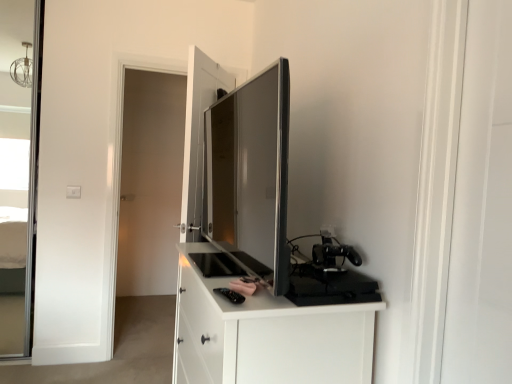
What do you see at coordinates (251, 172) in the screenshot? I see `matte black tv at center, which is the first appliance from left to right` at bounding box center [251, 172].

Image resolution: width=512 pixels, height=384 pixels. Describe the element at coordinates (482, 207) in the screenshot. I see `white glossy screen door at right, which is counted as the first screen door, starting from the right` at that location.

Measure the distance between white glossy screen door at right, the 2th screen door in the back-to-front sequence, and camera.

white glossy screen door at right, the 2th screen door in the back-to-front sequence, is 37.73 inches away from camera.

Describe the element at coordinates (150, 182) in the screenshot. I see `transparent glass door at left, which is the 2th screen door in right-to-left order` at that location.

Describe the element at coordinates (265, 334) in the screenshot. Image resolution: width=512 pixels, height=384 pixels. I see `white matte cabinet at center` at that location.

This screenshot has height=384, width=512. Describe the element at coordinates (333, 256) in the screenshot. I see `black matte gaming console at right, the 1th appliance viewed from the right` at that location.

How much space does black matte gaming console at right, arranged as the 1th appliance when ordered from the bottom, occupy horizontally?

It is 7.28 inches.

Find the location of a particular element. The width and height of the screenshot is (512, 384). matte black tv at center, which is the 2th appliance from right to left is located at coordinates [x=251, y=172].

Does white matte cabinet at center contain black matte gaming console at right, acting as the second appliance starting from the left?

No, black matte gaming console at right, acting as the second appliance starting from the left, is not surrounded by white matte cabinet at center.

Who is smaller, white matte cabinet at center or black matte gaming console at right, acting as the second appliance starting from the left?

black matte gaming console at right, acting as the second appliance starting from the left, is smaller.

Is white matte cabinet at center positioned with its back to black matte gaming console at right, the second appliance positioned from the top?

No, white matte cabinet at center's orientation is not away from black matte gaming console at right, the second appliance positioned from the top.

Considering the relative sizes of matte black tv at center, which is counted as the 1th appliance, starting from the top, and white glossy screen door at right, placed as the first screen door when sorted from front to back, in the image provided, is matte black tv at center, which is counted as the 1th appliance, starting from the top, bigger than white glossy screen door at right, placed as the first screen door when sorted from front to back,?

Correct, matte black tv at center, which is counted as the 1th appliance, starting from the top, is larger in size than white glossy screen door at right, placed as the first screen door when sorted from front to back.

From the image's perspective, which is below, matte black tv at center, which is counted as the 1th appliance, starting from the top, or white glossy screen door at right, positioned as the 2th screen door in left-to-right order?

white glossy screen door at right, positioned as the 2th screen door in left-to-right order, appears lower in the image.

Can you confirm if matte black tv at center, which is the first appliance from left to right, is positioned to the right of white glossy screen door at right, which is counted as the first screen door, starting from the right?

In fact, matte black tv at center, which is the first appliance from left to right, is to the left of white glossy screen door at right, which is counted as the first screen door, starting from the right.

Is matte black tv at center, which is the 2th appliance from right to left, facing away from white glossy screen door at right, positioned as the 2th screen door in left-to-right order?

No.

In the scene shown: Is white glossy screen door at right, placed as the first screen door when sorted from front to back, looking in the opposite direction of matte black tv at center, which is the 2th appliance from right to left?

white glossy screen door at right, placed as the first screen door when sorted from front to back, is not turned away from matte black tv at center, which is the 2th appliance from right to left.

Does point (474, 251) come in front of point (206, 111)?

Yes, it is.

Between white glossy screen door at right, the 2th screen door in the back-to-front sequence, and matte black tv at center, which is the 2th appliance from right to left, which one has less height?

Standing shorter between the two is matte black tv at center, which is the 2th appliance from right to left.

From a real-world perspective, is white glossy screen door at right, positioned as the 2th screen door in left-to-right order, physically located above or below matte black tv at center, the second appliance when ordered from bottom to top?

white glossy screen door at right, positioned as the 2th screen door in left-to-right order, is below matte black tv at center, the second appliance when ordered from bottom to top.

Can you confirm if white matte cabinet at center is bigger than matte black tv at center, which is the 2th appliance from right to left?

Indeed, white matte cabinet at center has a larger size compared to matte black tv at center, which is the 2th appliance from right to left.

From a real-world perspective, does white matte cabinet at center sit lower than matte black tv at center, which is the first appliance from left to right?

Indeed, from a real-world perspective, white matte cabinet at center is positioned beneath matte black tv at center, which is the first appliance from left to right.

How far apart are white matte cabinet at center and matte black tv at center, which is counted as the 1th appliance, starting from the top?

white matte cabinet at center is 11.91 inches away from matte black tv at center, which is counted as the 1th appliance, starting from the top.

What's the angular difference between white matte cabinet at center and matte black tv at center, the second appliance when ordered from bottom to top,'s facing directions?

The facing directions of white matte cabinet at center and matte black tv at center, the second appliance when ordered from bottom to top, are 1.34 degrees apart.

From the picture: From a real-world perspective, between white glossy screen door at right, positioned as the 2th screen door in left-to-right order, and white matte cabinet at center, who is vertically lower?

white matte cabinet at center is physically lower.

Considering the sizes of objects white glossy screen door at right, positioned as the 2th screen door in left-to-right order, and white matte cabinet at center in the image provided, who is wider, white glossy screen door at right, positioned as the 2th screen door in left-to-right order, or white matte cabinet at center?

white matte cabinet at center.

Could you measure the distance between white glossy screen door at right, which is counted as the first screen door, starting from the right, and white matte cabinet at center?

white glossy screen door at right, which is counted as the first screen door, starting from the right, is 25.70 inches from white matte cabinet at center.

Considering the positions of objects white glossy screen door at right, the 2th screen door in the back-to-front sequence, and white matte cabinet at center in the image provided, who is more to the left, white glossy screen door at right, the 2th screen door in the back-to-front sequence, or white matte cabinet at center?

white matte cabinet at center is more to the left.

From the image's perspective, which is above, transparent glass door at left, the second screen door in the front-to-back sequence, or black matte gaming console at right, arranged as the 1th appliance when ordered from the bottom?

transparent glass door at left, the second screen door in the front-to-back sequence, is shown above in the image.

Between transparent glass door at left, the 1th screen door viewed from the back, and black matte gaming console at right, acting as the second appliance starting from the left, which one appears on the left side from the viewer's perspective?

transparent glass door at left, the 1th screen door viewed from the back, is more to the left.

From the picture: Based on their sizes in the image, would you say transparent glass door at left, the second screen door in the front-to-back sequence, is bigger or smaller than black matte gaming console at right, acting as the second appliance starting from the left?

In the image, transparent glass door at left, the second screen door in the front-to-back sequence, appears to be larger than black matte gaming console at right, acting as the second appliance starting from the left.

Find the location of a particular element. This screenshot has width=512, height=384. cabinetry lying in front of the transparent glass door at left, which is the 2th screen door in right-to-left order is located at coordinates (265, 334).

Considering the relative sizes of transparent glass door at left, the first screen door when ordered from left to right, and white matte cabinet at center in the image provided, is transparent glass door at left, the first screen door when ordered from left to right, smaller than white matte cabinet at center?

Correct, transparent glass door at left, the first screen door when ordered from left to right, occupies less space than white matte cabinet at center.

Which is behind, transparent glass door at left, the second screen door in the front-to-back sequence, or white matte cabinet at center?

transparent glass door at left, the second screen door in the front-to-back sequence, is further away from the camera.

At what (x,y) coordinates should I click in order to perform the action: click on appliance that is on the right side of white matte cabinet at center. Please return your answer as a coordinate pair (x, y). Looking at the image, I should click on (333, 256).

Where is `the 1st screen door directly beneath the matte black tv at center, which is the first appliance from left to right (from a real-world perspective)`? The image size is (512, 384). the 1st screen door directly beneath the matte black tv at center, which is the first appliance from left to right (from a real-world perspective) is located at coordinates (482, 207).

Looking at the image, which one is located closer to white matte cabinet at center, transparent glass door at left, the second screen door in the front-to-back sequence, or white glossy screen door at right, placed as the first screen door when sorted from front to back?

white glossy screen door at right, placed as the first screen door when sorted from front to back, is positioned closer to the anchor white matte cabinet at center.

When comparing their distances from white glossy screen door at right, placed as the first screen door when sorted from front to back, does black matte gaming console at right, the 1th appliance viewed from the right, or transparent glass door at left, which is the 2th screen door in right-to-left order, seem closer?

Based on the image, black matte gaming console at right, the 1th appliance viewed from the right, appears to be nearer to white glossy screen door at right, placed as the first screen door when sorted from front to back.

When comparing their distances from transparent glass door at left, which is the 2th screen door in right-to-left order, does black matte gaming console at right, acting as the second appliance starting from the left, or matte black tv at center, the second appliance when ordered from bottom to top, seem further?

black matte gaming console at right, acting as the second appliance starting from the left, is further to transparent glass door at left, which is the 2th screen door in right-to-left order.

Estimate the real-world distances between objects in this image. Which object is further from white matte cabinet at center, white glossy screen door at right, which is counted as the first screen door, starting from the right, or transparent glass door at left, the first screen door when ordered from left to right?

Among the two, transparent glass door at left, the first screen door when ordered from left to right, is located further to white matte cabinet at center.

Based on their spatial positions, is black matte gaming console at right, the 1th appliance viewed from the right, or white glossy screen door at right, which is counted as the first screen door, starting from the right, closer to transparent glass door at left, which is the 2th screen door in right-to-left order?

Based on the image, black matte gaming console at right, the 1th appliance viewed from the right, appears to be nearer to transparent glass door at left, which is the 2th screen door in right-to-left order.

When comparing their distances from white matte cabinet at center, does black matte gaming console at right, acting as the second appliance starting from the left, or transparent glass door at left, the first screen door when ordered from left to right, seem further?

Among the two, transparent glass door at left, the first screen door when ordered from left to right, is located further to white matte cabinet at center.

Considering their positions, is white glossy screen door at right, positioned as the 2th screen door in left-to-right order, positioned closer to transparent glass door at left, the second screen door in the front-to-back sequence, than matte black tv at center, which is counted as the 1th appliance, starting from the top?

matte black tv at center, which is counted as the 1th appliance, starting from the top, is closer to transparent glass door at left, the second screen door in the front-to-back sequence.

Based on the photo, from the image, which object appears to be nearer to matte black tv at center, which is the first appliance from left to right, black matte gaming console at right, the 1th appliance viewed from the right, or transparent glass door at left, which is the 2th screen door in right-to-left order?

black matte gaming console at right, the 1th appliance viewed from the right.

Find the location of a particular element. The width and height of the screenshot is (512, 384). appliance between white glossy screen door at right, the 2th screen door in the back-to-front sequence, and white matte cabinet at center in the up-down direction is located at coordinates (333, 256).

Locate an element on the screen. This screenshot has height=384, width=512. appliance between white matte cabinet at center and transparent glass door at left, the second screen door in the front-to-back sequence, from front to back is located at coordinates (333, 256).

Locate an element on the screen. The width and height of the screenshot is (512, 384). appliance between matte black tv at center, the second appliance when ordered from bottom to top, and white glossy screen door at right, which is counted as the first screen door, starting from the right, in the horizontal direction is located at coordinates (333, 256).

Identify the location of appliance between matte black tv at center, the second appliance when ordered from bottom to top, and white matte cabinet at center from top to bottom. (333, 256).